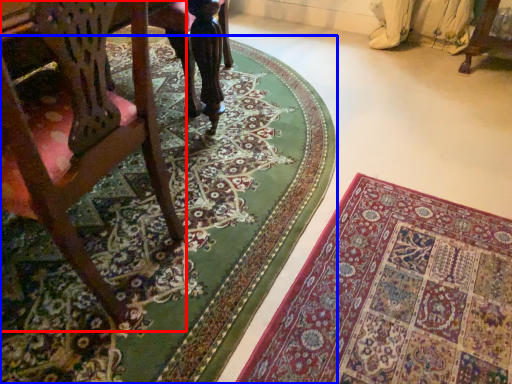
Question: Which point is further to the camera, chair (highlighted by a red box) or mat (highlighted by a blue box)?

Choices:
 (A) chair
 (B) mat

Answer: (B)